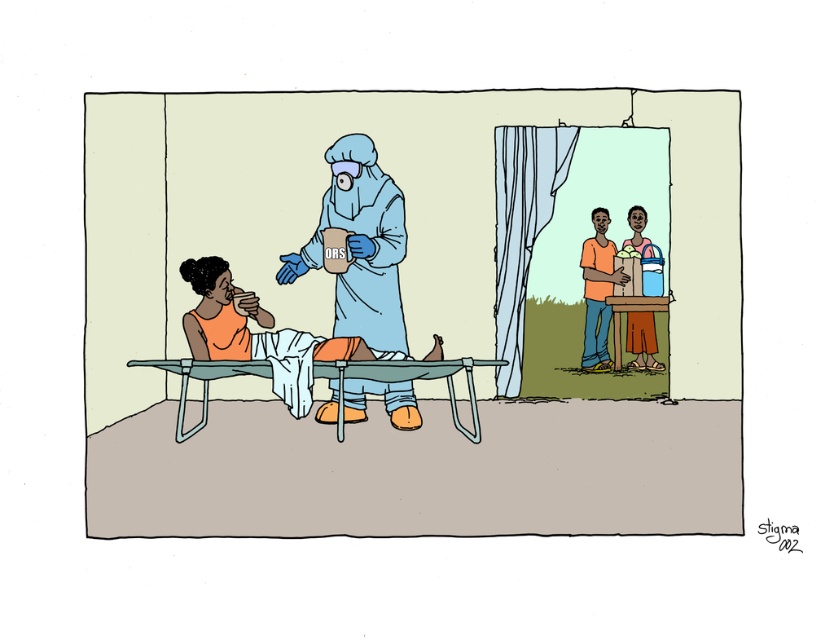
You are a healthcare worker in the clinic. You need to give the patient an ORS solution. Where should you place the matte plastic cup at center after preparing the solution?

You should place the matte plastic cup at center at point (410, 310).

You are a healthcare worker in the clinic. You need to place a new medical kit on the floor between the matte plastic cup at center and the orange fabric patient at center. Which object should you move to make space?

The matte plastic cup at center occupies less space than the orange fabric patient at center, so you should move the matte plastic cup at center to create more space for the medical kit.